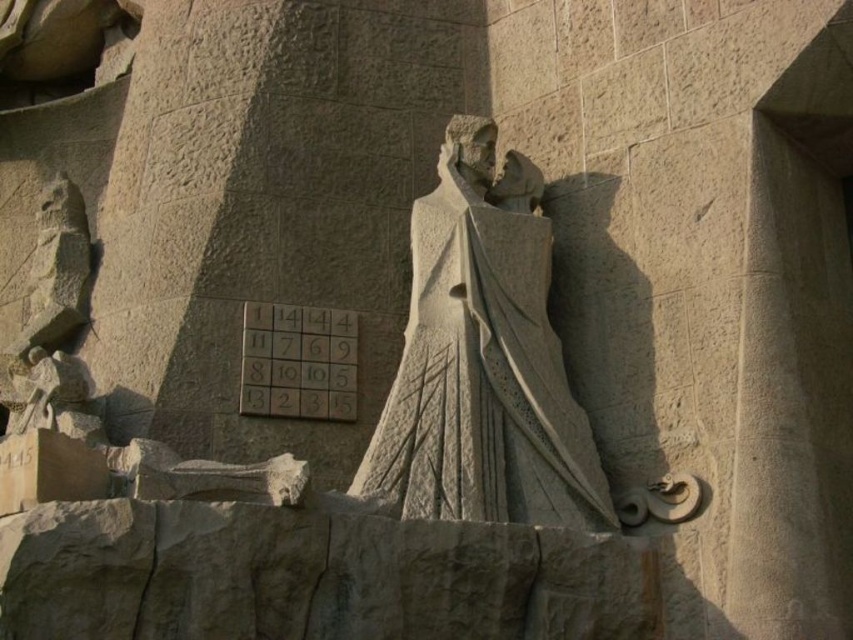
Is stone statue at center shorter than matte stone plaque at center?

No.

Is point (543, 273) behind point (341, 364)?

No, (543, 273) is closer to viewer.

Find the location of a particular element. stone statue at center is located at coordinates (482, 360).